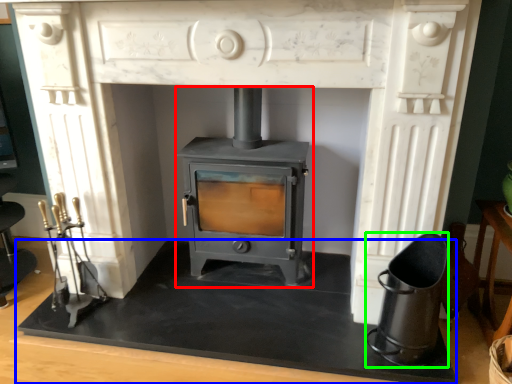
Question: Which is nearer to the wood burning stove (highlighted by a red box)? slate (highlighted by a blue box) or appliance (highlighted by a green box).

Choices:
 (A) slate
 (B) appliance

Answer: (A)